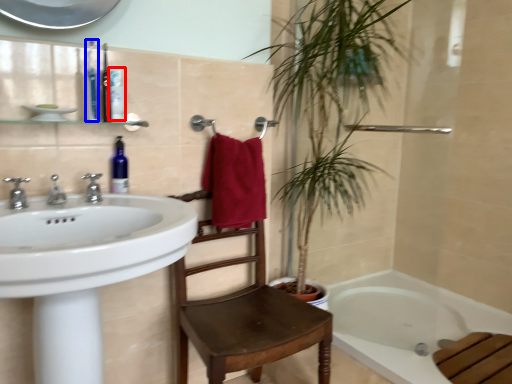
Question: Which point is closer to the camera, toiletry (highlighted by a red box) or toiletry (highlighted by a blue box)?

Choices:
 (A) toiletry
 (B) toiletry

Answer: (B)